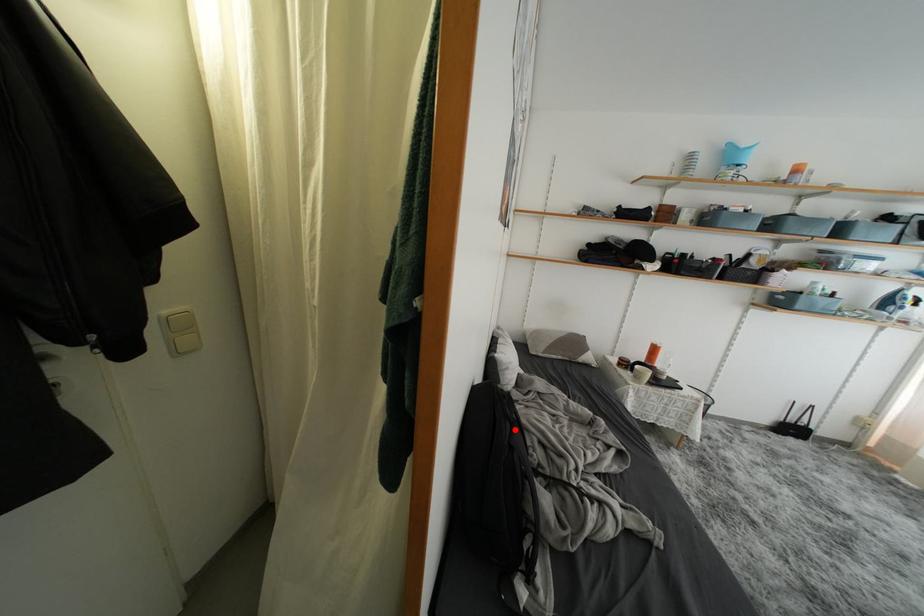
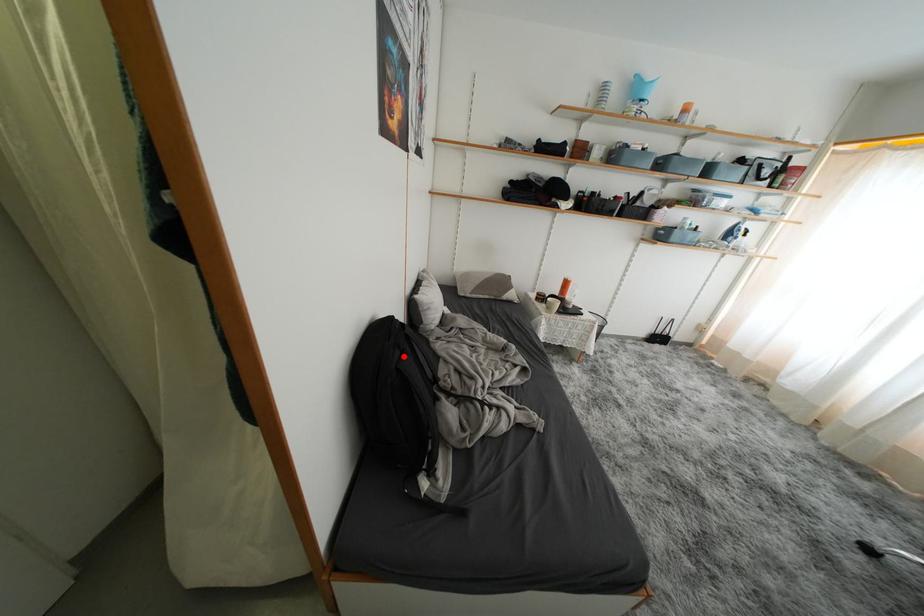
I am providing you with two images of the same scene from different viewpoints. A red point is marked on the first image and another point is marked on the second image. Does the point marked in image1 correspond to the same location as the one in image2?

Yes